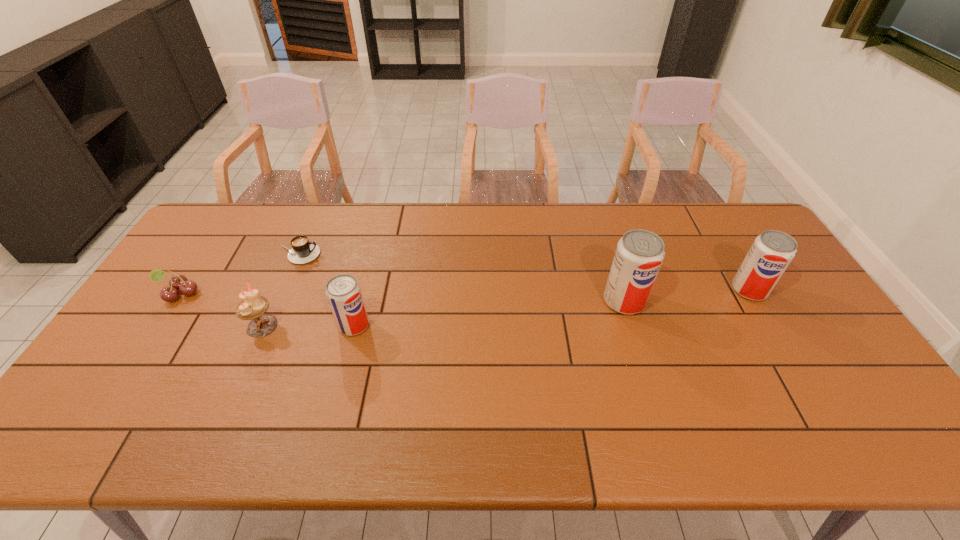
Identify the location of vacant area located on the right of the leftmost soda. (438, 325).

Locate an element on the screen. vacant area situated 0.210m on the front of the fifth object from left to right is located at coordinates pyautogui.click(x=649, y=382).

Locate an element on the screen. vacant space located 0.260m on the back of the rightmost object is located at coordinates (710, 225).

Locate an element on the screen. vacant space situated 0.140m with the handle on the side of the farthest object is located at coordinates (363, 254).

Where is `vacant region located 0.260m on the leaves of the second shortest object`? Image resolution: width=960 pixels, height=540 pixels. vacant region located 0.260m on the leaves of the second shortest object is located at coordinates (120, 384).

Locate an element on the screen. This screenshot has height=540, width=960. vacant space located 0.280m on the right of the candle holder is located at coordinates (378, 326).

At what (x,y) coordinates should I click in order to perform the action: click on object that is at the far edge. Please return your answer as a coordinate pair (x, y). This screenshot has height=540, width=960. Looking at the image, I should click on (303, 251).

Find the location of a particular element. Image resolution: width=960 pixels, height=540 pixels. object that is at the left edge is located at coordinates (177, 282).

Where is `object that is at the right edge`? Image resolution: width=960 pixels, height=540 pixels. object that is at the right edge is located at coordinates (771, 253).

At what (x,y) coordinates should I click in order to perform the action: click on vacant space at the far edge. Please return your answer as a coordinate pair (x, y). This screenshot has width=960, height=540. Looking at the image, I should click on (588, 238).